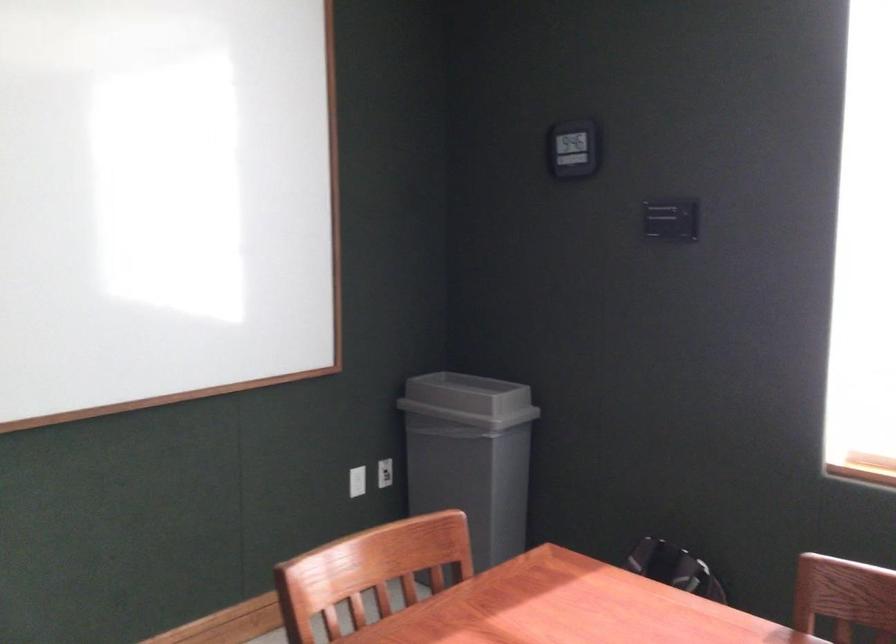
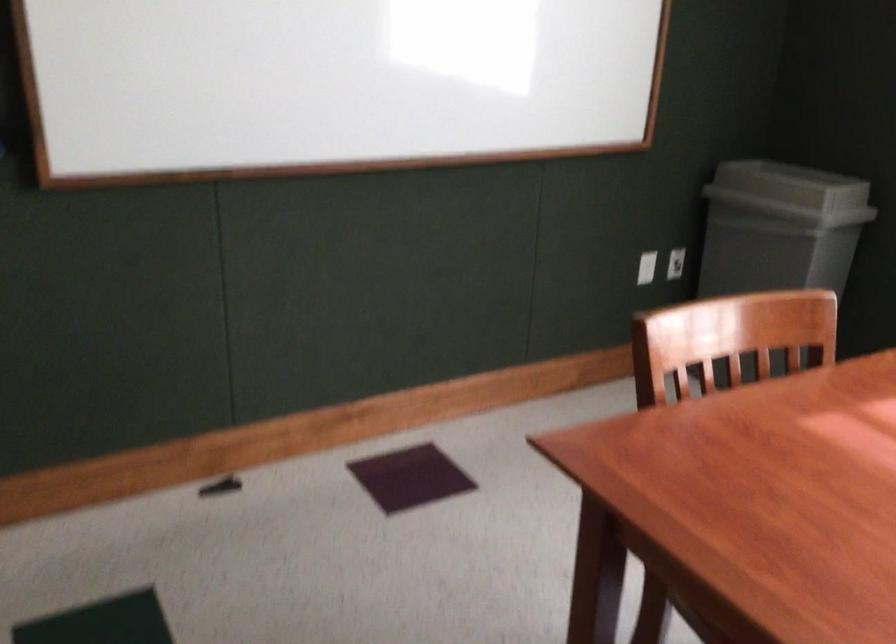
In the second image, find the point that corresponds to point 464,401 in the first image.

(791, 185)